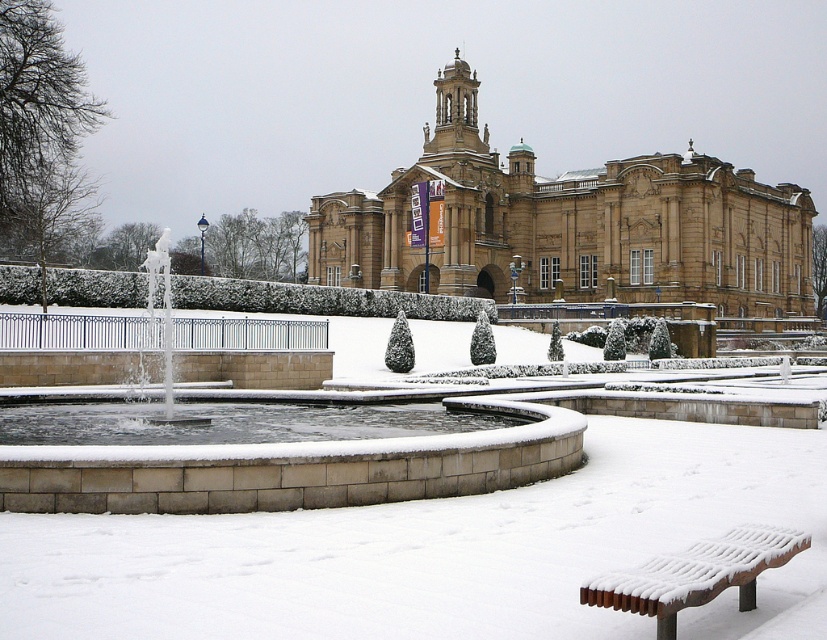
Between beige stone building at center and snow-covered wooden bench at lower right, which one has more height?

With more height is beige stone building at center.

Find the location of a particular element. beige stone building at center is located at coordinates (567, 225).

Is point (634, 182) behind point (600, 598)?

Yes, it is behind point (600, 598).

This screenshot has width=827, height=640. What are the coordinates of `beige stone building at center` in the screenshot? It's located at (567, 225).

Who is shorter, beige stone building at center or white stone fountain at center?

With less height is white stone fountain at center.

Which is in front, point (510, 262) or point (216, 486)?

Point (216, 486)

Is point (719, 292) more distant than point (146, 324)?

Yes, point (719, 292) is farther from viewer.

Where is `beige stone building at center`? beige stone building at center is located at coordinates (567, 225).

Can you confirm if white stone fountain at center is positioned to the left of snow-covered wooden bench at lower right?

Indeed, white stone fountain at center is positioned on the left side of snow-covered wooden bench at lower right.

Based on the photo, is white stone fountain at center bigger than snow-covered wooden bench at lower right?

Correct, white stone fountain at center is larger in size than snow-covered wooden bench at lower right.

Does point (294, 486) come in front of point (784, 545)?

No, it is not.

At what (x,y) coordinates should I click in order to perform the action: click on white stone fountain at center. Please return your answer as a coordinate pair (x, y). Image resolution: width=827 pixels, height=640 pixels. Looking at the image, I should click on (290, 468).